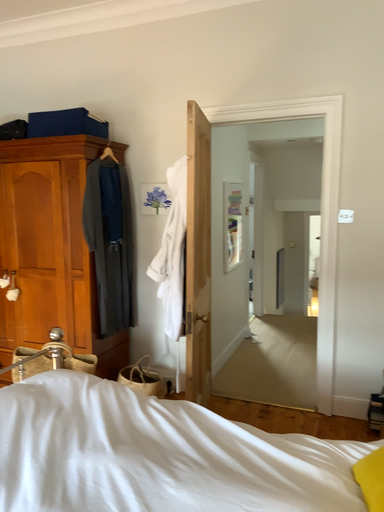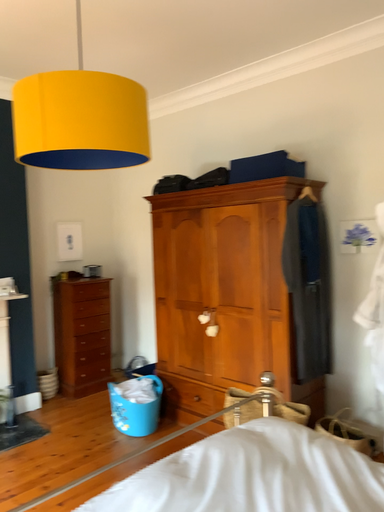
Question: How did the camera likely rotate when shooting the video?

Choices:
 (A) rotated left
 (B) rotated right

Answer: (A)